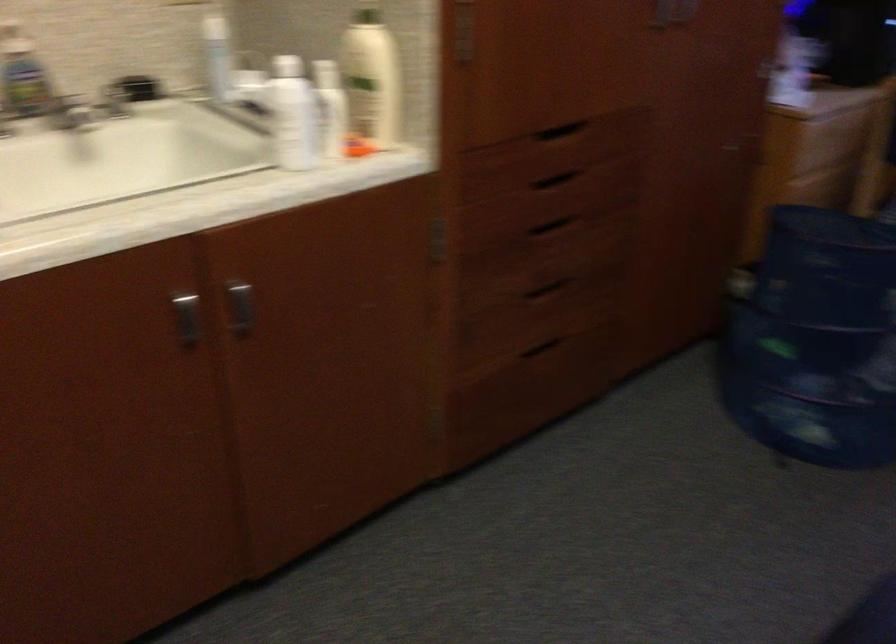
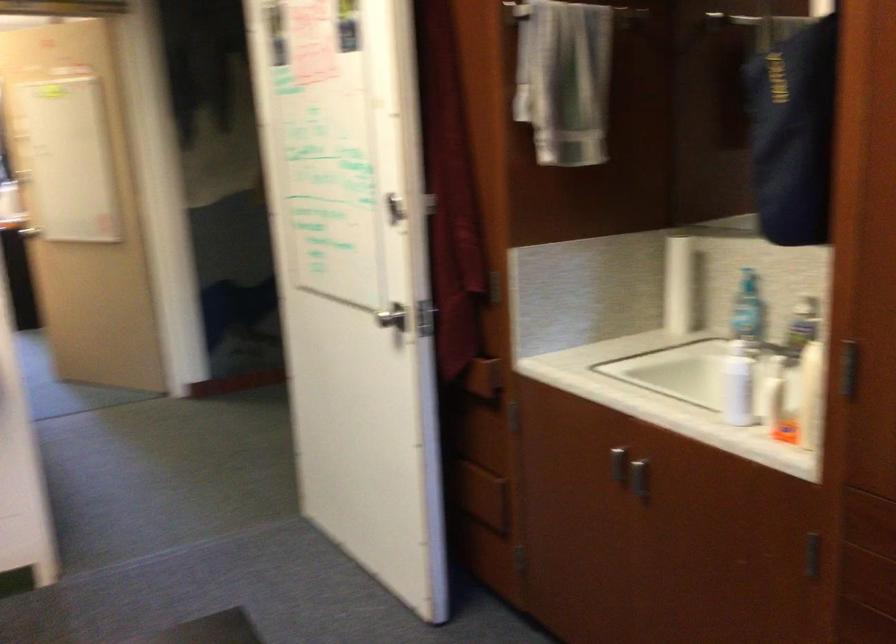
In the second image, find the point that corresponds to pixel 205 323 in the first image.

(634, 477)